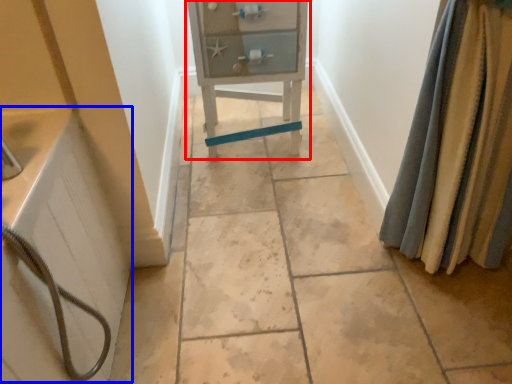
Question: Which of the following is the farthest to the observer, furniture (highlighted by a red box) or bath (highlighted by a blue box)?

Choices:
 (A) furniture
 (B) bath

Answer: (A)